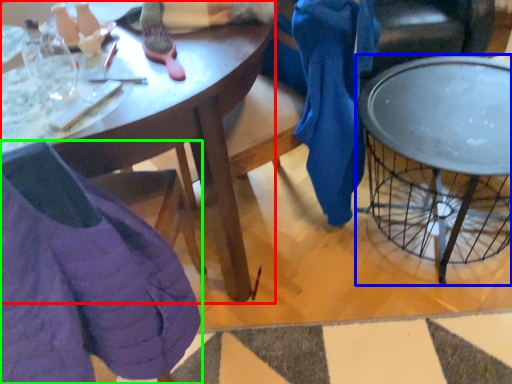
Question: Which is farther away from desk (highlighted by a red box)? coffee table (highlighted by a blue box) or chair (highlighted by a green box)?

Choices:
 (A) coffee table
 (B) chair

Answer: (A)